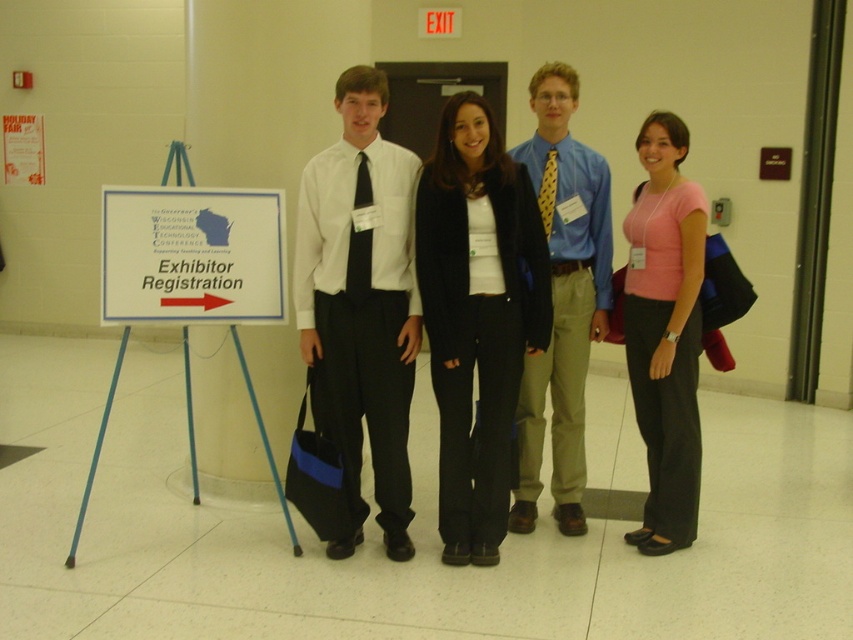
Does white matte shirt at center have a greater width compared to black wool blazer at center?

In fact, white matte shirt at center might be narrower than black wool blazer at center.

Who is more distant from viewer, (379, 413) or (514, 355)?

Point (379, 413)

Locate an element on the screen. The height and width of the screenshot is (640, 853). white matte shirt at center is located at coordinates (361, 305).

Which is in front, point (569, 477) or point (218, 257)?

Point (218, 257) is more forward.

Is point (556, 198) positioned behind point (271, 212)?

Yes, point (556, 198) is farther from viewer.

Which is in front, point (584, 260) or point (268, 317)?

Point (268, 317) is more forward.

Where is `blue shirt at center`? blue shirt at center is located at coordinates (561, 298).

Between black wool blazer at center and white plastic sign at left, which one appears on the right side from the viewer's perspective?

Positioned to the right is black wool blazer at center.

Which is in front, point (482, 548) or point (192, 278)?

Point (482, 548) is in front.

Who is more distant from viewer, (469,252) or (126,216)?

Positioned behind is point (126,216).

The image size is (853, 640). I want to click on black wool blazer at center, so click(x=477, y=316).